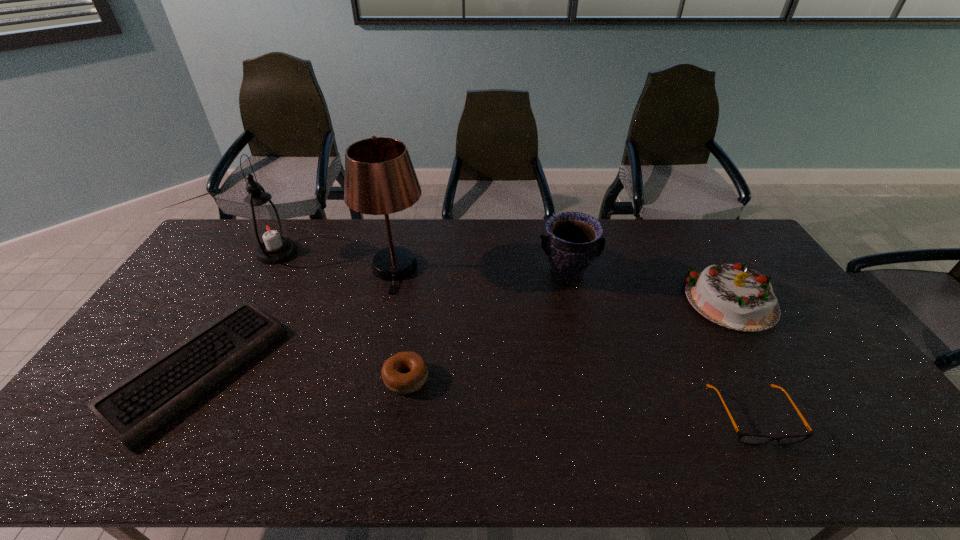
What are the coordinates of `blank space located on the front handle of the pottery` in the screenshot? It's located at (574, 312).

Locate an element on the screen. The height and width of the screenshot is (540, 960). blank area located on the front of the cake is located at coordinates (794, 403).

Locate an element on the screen. The image size is (960, 540). blank area located on the back of the bagel is located at coordinates (419, 294).

Locate an element on the screen. The width and height of the screenshot is (960, 540). free space located on the back of the computer keyboard is located at coordinates (248, 285).

Locate an element on the screen. Image resolution: width=960 pixels, height=540 pixels. lampshade located in the far edge section of the desktop is located at coordinates (380, 179).

I want to click on oil lamp located at the far edge, so click(267, 227).

Where is `spectacles at the near edge`? Image resolution: width=960 pixels, height=540 pixels. spectacles at the near edge is located at coordinates (751, 439).

Locate an element on the screen. computer keyboard that is at the near edge is located at coordinates (134, 409).

What are the coordinates of `object located at the left edge` in the screenshot? It's located at (134, 409).

Locate an element on the screen. The width and height of the screenshot is (960, 540). object positioned at the right edge is located at coordinates (737, 297).